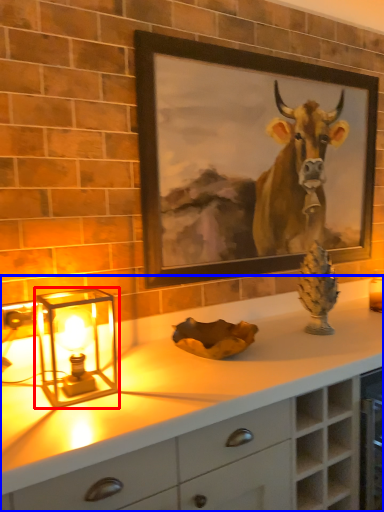
Question: Which object appears closest to the camera in this image, table lamp (highlighted by a red box) or countertop (highlighted by a blue box)?

Choices:
 (A) table lamp
 (B) countertop

Answer: (B)